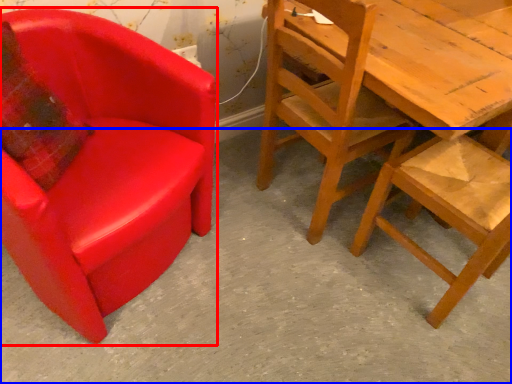
Question: Which object appears farthest to the camera in this image, chair (highlighted by a red box) or concrete (highlighted by a blue box)?

Choices:
 (A) chair
 (B) concrete

Answer: (B)